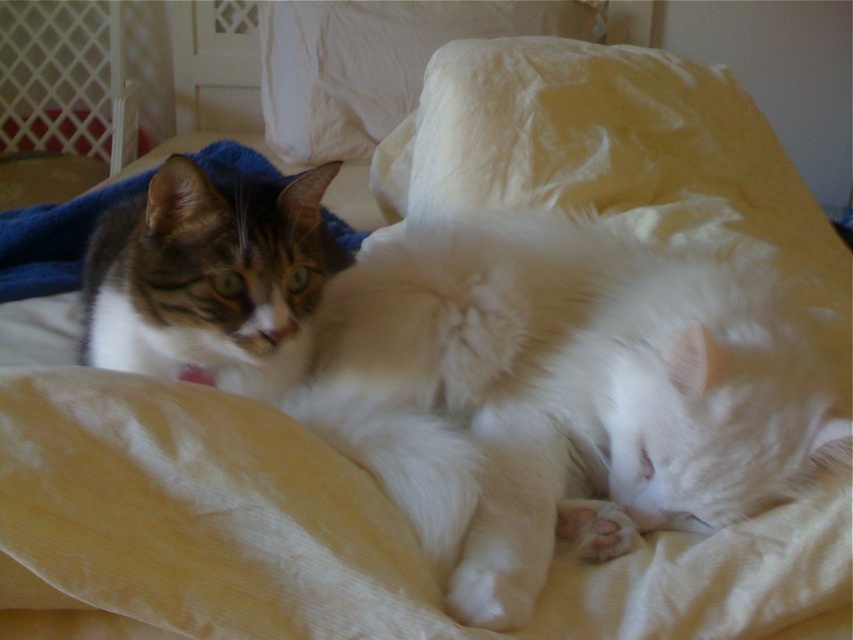
Who is more distant from viewer, (439, 260) or (99, 282)?

The point (99, 282) is behind.

Can you confirm if tabby fur cat at upper left is positioned below tabby fur cat at left?

Indeed, tabby fur cat at upper left is positioned under tabby fur cat at left.

Is point (318, 365) positioned in front of point (254, 252)?

That is False.

Where is `tabby fur cat at upper left`? This screenshot has height=640, width=853. tabby fur cat at upper left is located at coordinates (468, 365).

Between white soft pillow at upper center and blue soft blanket at upper left, which one is positioned lower?

blue soft blanket at upper left is lower down.

Which is in front, point (312, 8) or point (62, 282)?

Point (62, 282) is in front.

This screenshot has width=853, height=640. Describe the element at coordinates (375, 61) in the screenshot. I see `white soft pillow at upper center` at that location.

At what (x,y) coordinates should I click in order to perform the action: click on white soft pillow at upper center. Please return your answer as a coordinate pair (x, y). Looking at the image, I should click on (375, 61).

Based on the photo, can you confirm if tabby fur cat at left is positioned to the left of white soft pillow at upper center?

Correct, you'll find tabby fur cat at left to the left of white soft pillow at upper center.

Can you confirm if tabby fur cat at left is bigger than white soft pillow at upper center?

Incorrect, tabby fur cat at left is not larger than white soft pillow at upper center.

Is point (299, 192) behind point (276, 134)?

No, (299, 192) is in front of (276, 134).

Identify the location of tabby fur cat at left. (209, 275).